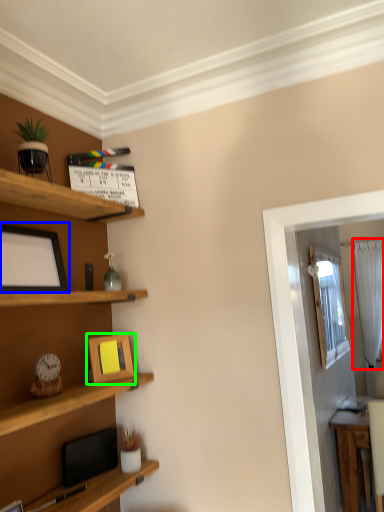
Question: Considering the real-world distances, which object is farthest from curtain (highlighted by a red box)? picture frame (highlighted by a blue box) or picture frame (highlighted by a green box)?

Choices:
 (A) picture frame
 (B) picture frame

Answer: (A)